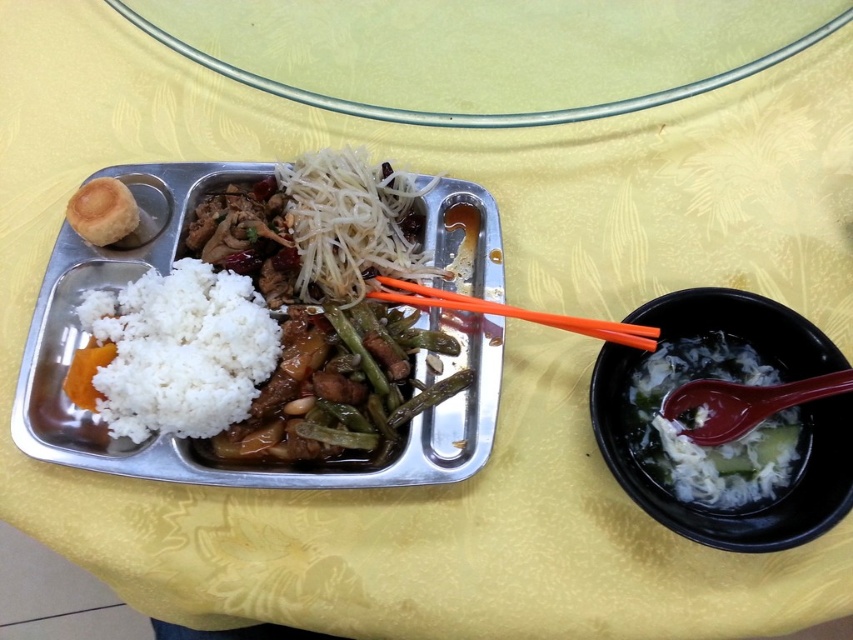
Question: Does white matte rice at center appear on the right side of matte brown bun at upper left?

Choices:
 (A) no
 (B) yes

Answer: (B)

Question: Is white matte rice at center left positioned at the back of matte brown bun at upper left?

Choices:
 (A) no
 (B) yes

Answer: (A)

Question: Which point is farther from the camera taking this photo?

Choices:
 (A) (680, 356)
 (B) (96, 225)
 (C) (820, 340)

Answer: (A)

Question: Does white matte rice at center appear over orange plastic chopsticks at center?

Choices:
 (A) no
 (B) yes

Answer: (A)

Question: Which of the following is the closest to the observer?

Choices:
 (A) matte brown bun at upper left
 (B) white matte rice at center left
 (C) transparent glass plate at upper center
 (D) white matte bowl at right

Answer: (D)

Question: Which point is farther to the camera?

Choices:
 (A) (758, 499)
 (B) (492, 236)
 (C) (654, 340)

Answer: (B)